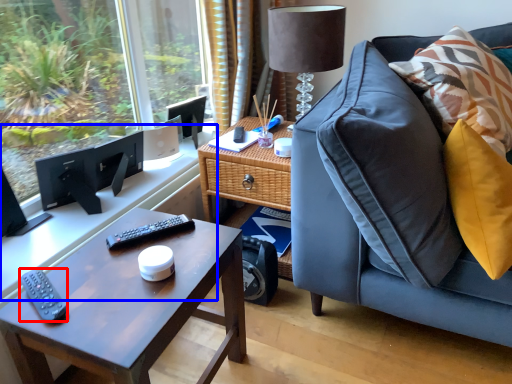
Question: Which object is closer to the camera taking this photo, remote (highlighted by a red box) or computer desk (highlighted by a blue box)?

Choices:
 (A) remote
 (B) computer desk

Answer: (A)